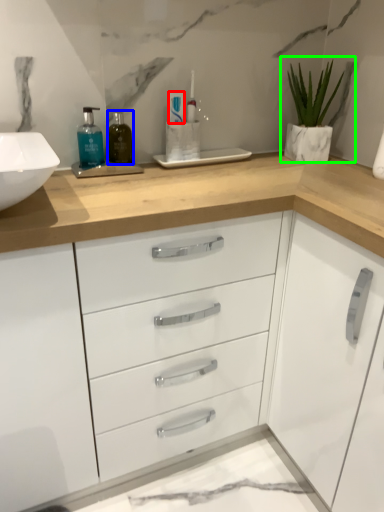
Question: Which is farther away from toothpaste (highlighted by a red box)? mouthwash (highlighted by a blue box) or houseplant (highlighted by a green box)?

Choices:
 (A) mouthwash
 (B) houseplant

Answer: (B)